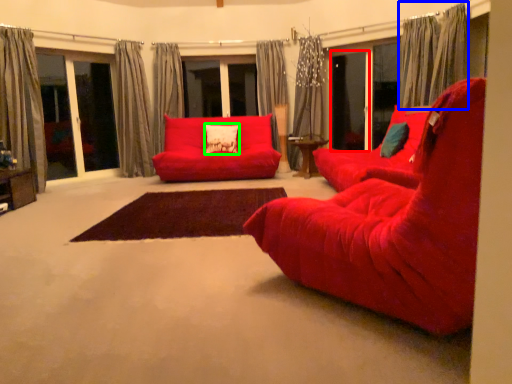
Question: Which is farther away from screen door (highlighted by a red box)? curtain (highlighted by a blue box) or pillow (highlighted by a green box)?

Choices:
 (A) curtain
 (B) pillow

Answer: (B)